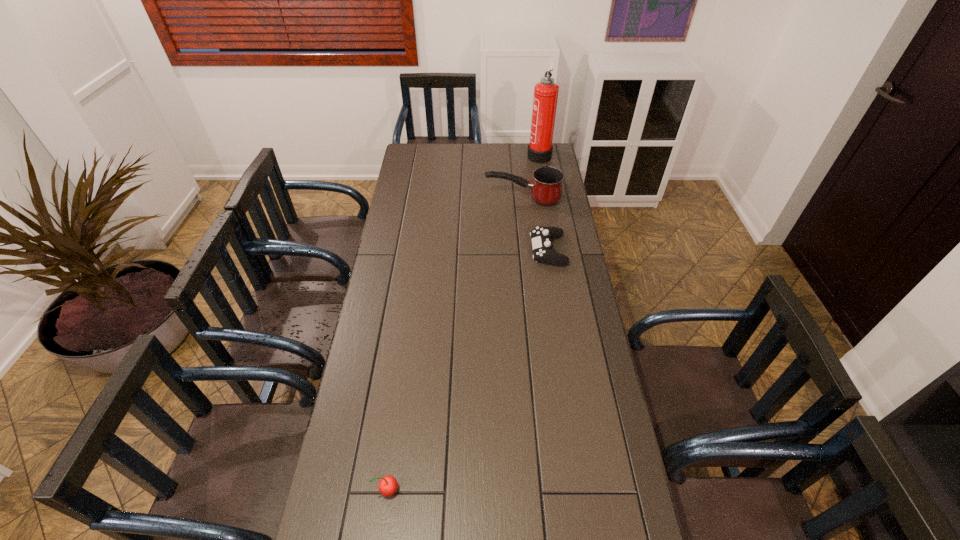
The width and height of the screenshot is (960, 540). In order to click on fire extinguisher located in the right edge section of the desktop in this screenshot , I will do `click(540, 148)`.

The image size is (960, 540). In order to click on saucepan that is at the right edge in this screenshot , I will do `click(546, 188)`.

Find the location of a particular element. This screenshot has width=960, height=540. control that is at the right edge is located at coordinates (541, 237).

Locate an element on the screen. The image size is (960, 540). object present at the far right corner is located at coordinates (540, 148).

This screenshot has height=540, width=960. In the image, there is a desktop. In order to click on vacant space at the far edge in this screenshot , I will do `click(509, 154)`.

The width and height of the screenshot is (960, 540). What are the coordinates of `vacant region at the right edge` in the screenshot? It's located at [x=558, y=244].

Identify the location of vacant region at the far right corner. This screenshot has height=540, width=960. (549, 166).

Where is `free space between the third nearest object and the second nearest object`? free space between the third nearest object and the second nearest object is located at coordinates (536, 225).

Where is `free space between the third nearest object and the leftmost object`? free space between the third nearest object and the leftmost object is located at coordinates (455, 344).

What are the coordinates of `empty space between the third nearest object and the cherry` in the screenshot? It's located at (455, 344).